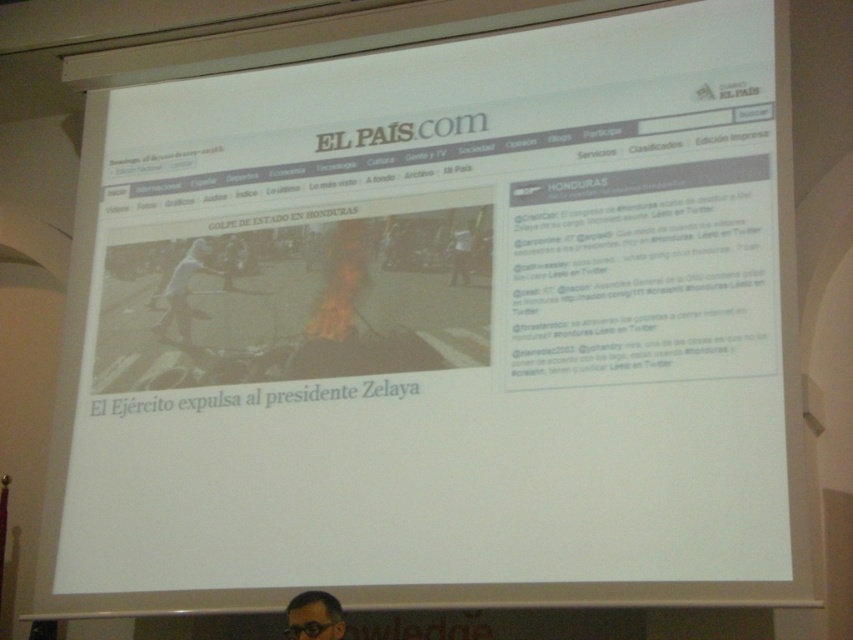
Who is taller, matte black glasses at lower center or black plastic goggles at lower center?

With more height is matte black glasses at lower center.

Can you confirm if matte black glasses at lower center is positioned below black plastic goggles at lower center?

No.

The image size is (853, 640). I want to click on matte black glasses at lower center, so click(312, 616).